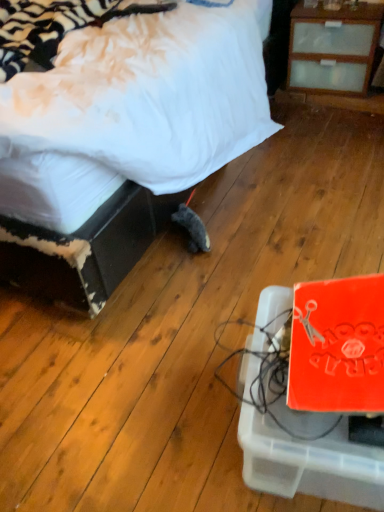
Question: Relative to orange matte cardboard box at lower right, is white soft bed at center in front or behind?

Choices:
 (A) front
 (B) behind

Answer: (B)

Question: From a real-world perspective, is white soft bed at center physically located above or below orange matte cardboard box at lower right?

Choices:
 (A) below
 (B) above

Answer: (B)

Question: From the image's perspective, is white soft bed at center located above or below orange matte cardboard box at lower right?

Choices:
 (A) below
 (B) above

Answer: (B)

Question: In terms of width, does orange matte cardboard box at lower right look wider or thinner when compared to white soft bed at center?

Choices:
 (A) thin
 (B) wide

Answer: (A)

Question: Considering the positions of point (264, 476) and point (97, 162), is point (264, 476) closer or farther from the camera than point (97, 162)?

Choices:
 (A) closer
 (B) farther

Answer: (A)

Question: Is orange matte cardboard box at lower right to the left or to the right of white soft bed at center in the image?

Choices:
 (A) left
 (B) right

Answer: (B)

Question: Do you think orange matte cardboard box at lower right is within white soft bed at center, or outside of it?

Choices:
 (A) outside
 (B) inside

Answer: (A)